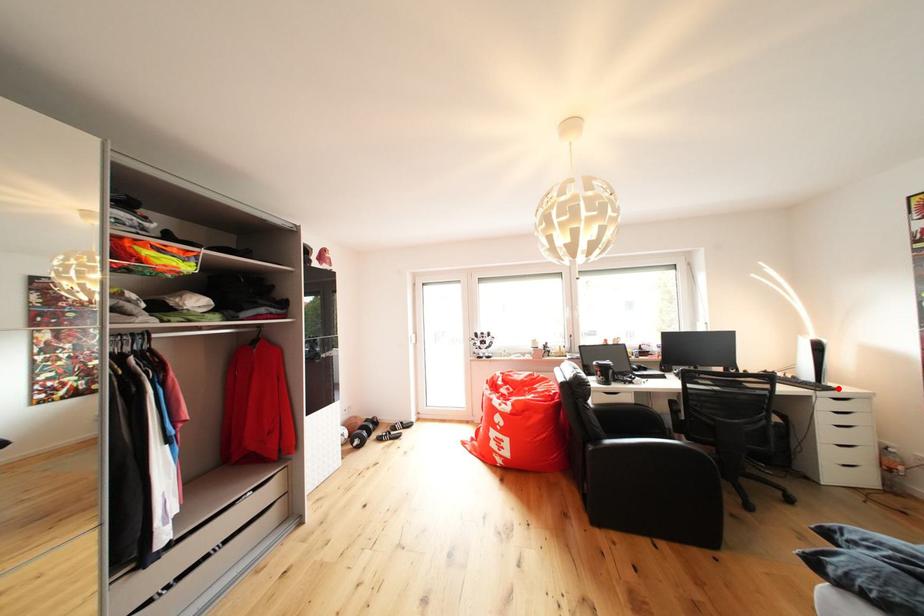
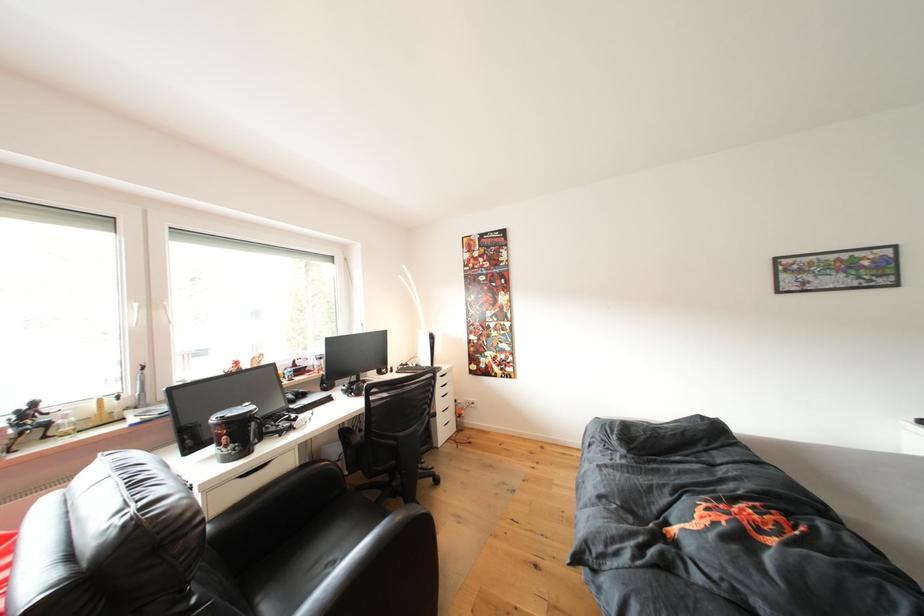
The point at the highlighted location is marked in the first image. Where is the corresponding point in the second image?

(444, 370)